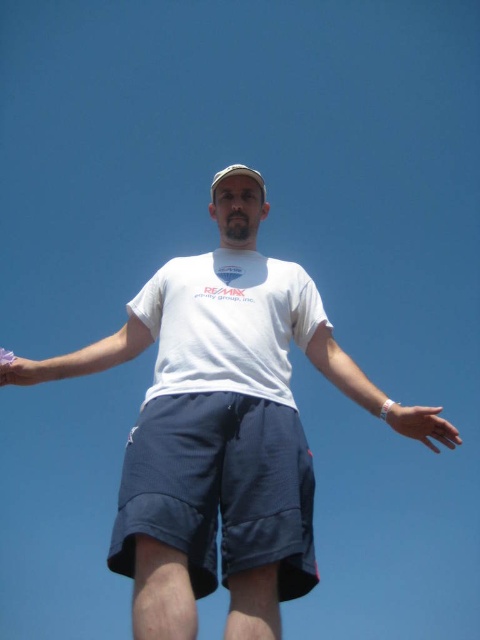
Who is taller, navy blue shorts at center or white fabric baseball hat at center?

Standing taller between the two is white fabric baseball hat at center.

Between navy blue shorts at center and white fabric baseball hat at center, which one has less height?

Standing shorter between the two is navy blue shorts at center.

Which is in front, point (145, 417) or point (263, 198)?

Point (145, 417)

Image resolution: width=480 pixels, height=640 pixels. Find the location of `navy blue shorts at center`. navy blue shorts at center is located at coordinates click(218, 490).

Does white cotton t-shirt at center have a larger size compared to white fabric baseball hat at center?

Correct, white cotton t-shirt at center is larger in size than white fabric baseball hat at center.

Does point (179, 435) come farther from viewer compared to point (226, 168)?

No, (179, 435) is closer to viewer.

Where is `white cotton t-shirt at center`? white cotton t-shirt at center is located at coordinates (219, 429).

You are a GUI agent. You are given a task and a screenshot of the screen. Output one action in this format:
    pyautogui.click(x=<x>, y=<y>)
    Task: Click on the white cotton t-shirt at center
    
    Given the screenshot: What is the action you would take?
    pyautogui.click(x=219, y=429)

Does matte white hand at lower right come behind white matte wristband at lower center?

No, matte white hand at lower right is in front of white matte wristband at lower center.

Who is more distant from viewer, (444, 429) or (14, 365)?

Point (14, 365)

Measure the distance between matte white hand at lower right and camera.

A distance of 24.44 meters exists between matte white hand at lower right and camera.

You are a GUI agent. You are given a task and a screenshot of the screen. Output one action in this format:
    pyautogui.click(x=<x>, y=<y>)
    Task: Click on the matte white hand at lower right
    The width and height of the screenshot is (480, 640).
    Given the screenshot: What is the action you would take?
    pyautogui.click(x=421, y=424)